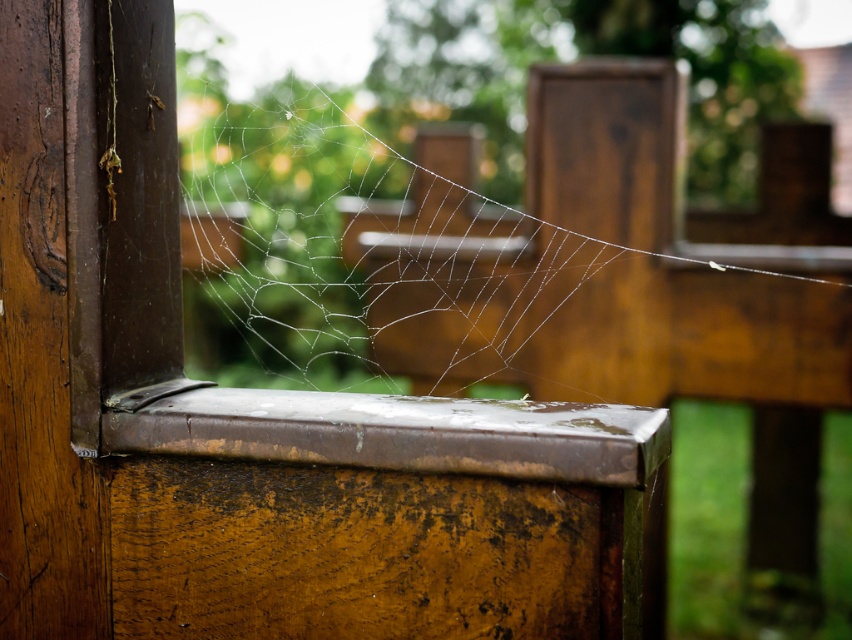
Question: Does transparent silk spider web at center lie behind rusty metal window sill at center?

Choices:
 (A) no
 (B) yes

Answer: (B)

Question: Which object is the farthest from the rusty metal window sill at center?

Choices:
 (A) transparent silk spider web at center
 (B) transparent glass window at left

Answer: (A)

Question: Does transparent silk spider web at center have a lesser width compared to transparent glass window at left?

Choices:
 (A) no
 (B) yes

Answer: (A)

Question: Among these objects, which one is farthest from the camera?

Choices:
 (A) transparent glass window at left
 (B) transparent silk spider web at center

Answer: (B)

Question: Is transparent glass window at left bigger than rusty metal window sill at center?

Choices:
 (A) no
 (B) yes

Answer: (B)

Question: Which of the following is the farthest from the observer?

Choices:
 (A) (461, 467)
 (B) (637, 384)

Answer: (B)